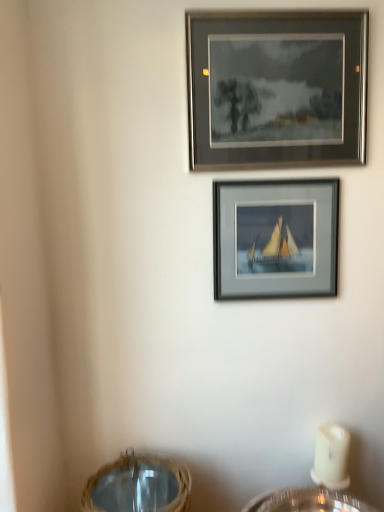
Question: Relative to matte gray frame at center, the second picture frame when ordered from top to bottom, is woven straw basket at lower center in front or behind?

Choices:
 (A) behind
 (B) front

Answer: (B)

Question: Does point click(x=162, y=466) appear closer or farther from the camera than point click(x=218, y=196)?

Choices:
 (A) farther
 (B) closer

Answer: (A)

Question: Which object is the farthest from the woven straw basket at lower center?

Choices:
 (A) matte gray frame at center, the second picture frame when ordered from top to bottom
 (B) matte gray frame at upper center, which is the 2th picture frame in bottom-to-top order

Answer: (B)

Question: Based on their relative distances, which object is nearer to the woven straw basket at lower center?

Choices:
 (A) matte gray frame at upper center, marked as the 1th picture frame in a top-to-bottom arrangement
 (B) matte gray frame at center, the first picture frame when ordered from bottom to top

Answer: (B)